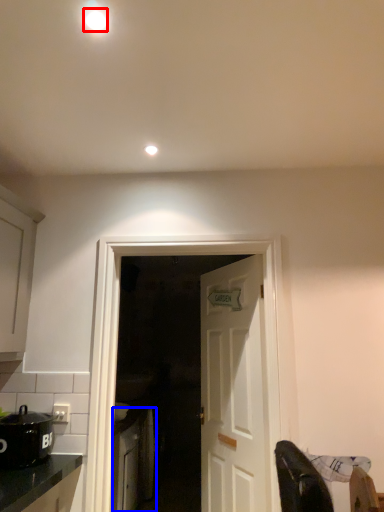
Question: Which object is closer to the camera taking this photo, lighting (highlighted by a red box) or cabinetry (highlighted by a blue box)?

Choices:
 (A) lighting
 (B) cabinetry

Answer: (A)